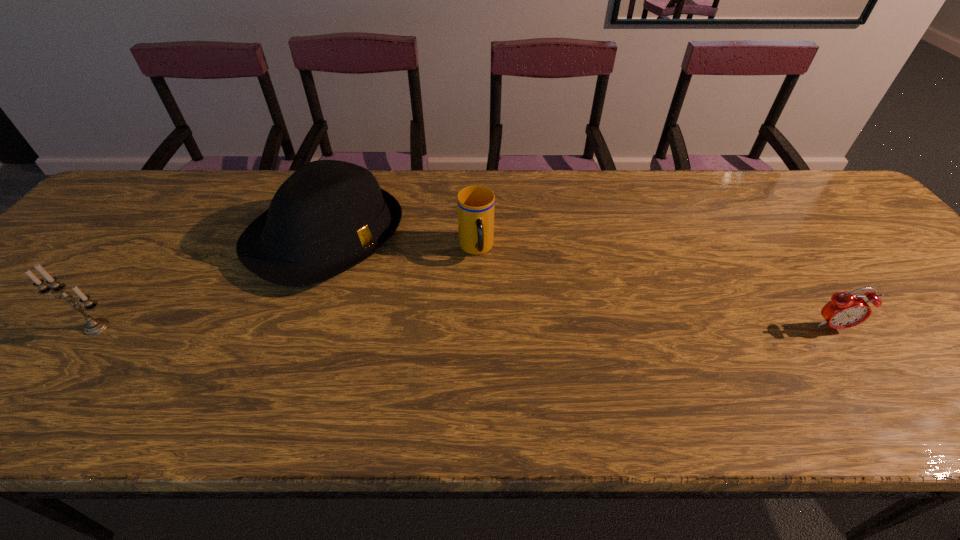
Where is `vacant space situated on the side of the third tallest object with the handle`? This screenshot has height=540, width=960. vacant space situated on the side of the third tallest object with the handle is located at coordinates (504, 377).

The height and width of the screenshot is (540, 960). What are the coordinates of `vacant space located 0.390m on the front-facing side of the second object from left to right` in the screenshot? It's located at (512, 348).

The image size is (960, 540). What are the coordinates of `blank space located 0.100m on the front-facing side of the second object from left to right` in the screenshot? It's located at (410, 288).

I want to click on free spot located 0.280m on the front-facing side of the second object from left to right, so click(470, 324).

Find the location of a particular element. This screenshot has width=960, height=540. object that is at the far edge is located at coordinates (328, 216).

Locate an element on the screen. The image size is (960, 540). object that is at the left edge is located at coordinates (94, 326).

Find the location of a particular element. The height and width of the screenshot is (540, 960). vacant space at the far edge of the desktop is located at coordinates (508, 194).

Locate an element on the screen. The width and height of the screenshot is (960, 540). blank space at the left edge of the desktop is located at coordinates (61, 262).

Where is `blank space at the right edge of the desktop`? blank space at the right edge of the desktop is located at coordinates (903, 308).

In the image, there is a desktop. At what (x,y) coordinates should I click in order to perform the action: click on blank space at the far left corner. Please return your answer as a coordinate pair (x, y). Looking at the image, I should click on (118, 194).